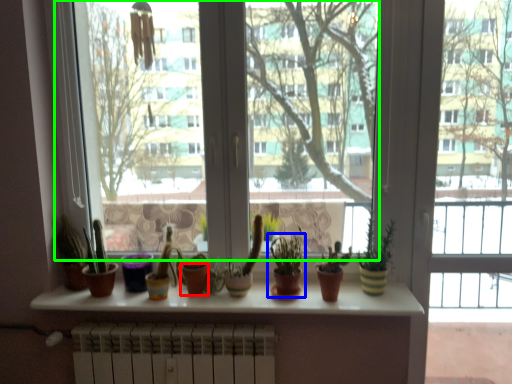
Question: Which object is the closest to the flowerpot (highlighted by a red box)? Choose among these: houseplant (highlighted by a blue box) or window screen (highlighted by a green box).

Choices:
 (A) houseplant
 (B) window screen

Answer: (A)